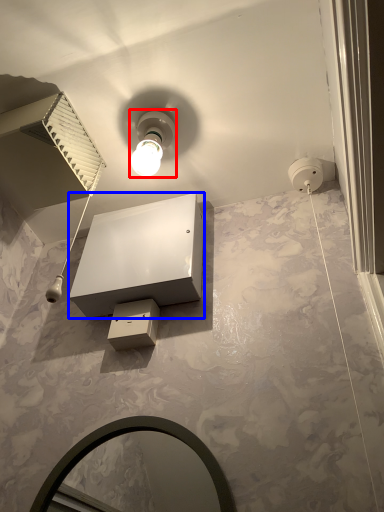
Question: Which object is closer to the camera taking this photo, light fixture (highlighted by a red box) or vanity (highlighted by a blue box)?

Choices:
 (A) light fixture
 (B) vanity

Answer: (B)